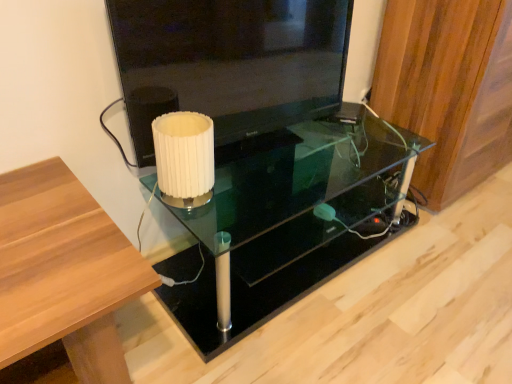
Question: Does white pleated paper at center come behind black glossy television at upper center?

Choices:
 (A) no
 (B) yes

Answer: (B)

Question: From the image's perspective, is white pleated paper at center beneath black glossy television at upper center?

Choices:
 (A) yes
 (B) no

Answer: (A)

Question: Is white pleated paper at center smaller than black glossy television at upper center?

Choices:
 (A) yes
 (B) no

Answer: (A)

Question: From the image's perspective, would you say white pleated paper at center is positioned over black glossy television at upper center?

Choices:
 (A) no
 (B) yes

Answer: (A)

Question: Can we say white pleated paper at center lies outside black glossy television at upper center?

Choices:
 (A) no
 (B) yes

Answer: (B)

Question: Is white pleated paper at center wider than black glossy television at upper center?

Choices:
 (A) yes
 (B) no

Answer: (A)

Question: Is wooden panel at right at the left side of transparent glass table at center?

Choices:
 (A) yes
 (B) no

Answer: (B)

Question: Is wooden panel at right surrounding transparent glass table at center?

Choices:
 (A) no
 (B) yes

Answer: (A)

Question: Is there a large distance between wooden panel at right and transparent glass table at center?

Choices:
 (A) yes
 (B) no

Answer: (B)

Question: Is the surface of wooden panel at right in direct contact with transparent glass table at center?

Choices:
 (A) yes
 (B) no

Answer: (B)

Question: Is wooden panel at right positioned in front of transparent glass table at center?

Choices:
 (A) no
 (B) yes

Answer: (A)

Question: From the image's perspective, is wooden panel at right on transparent glass table at center?

Choices:
 (A) yes
 (B) no

Answer: (A)

Question: Considering the relative sizes of white pleated paper at center and transparent glass table at center in the image provided, is white pleated paper at center wider than transparent glass table at center?

Choices:
 (A) yes
 (B) no

Answer: (B)